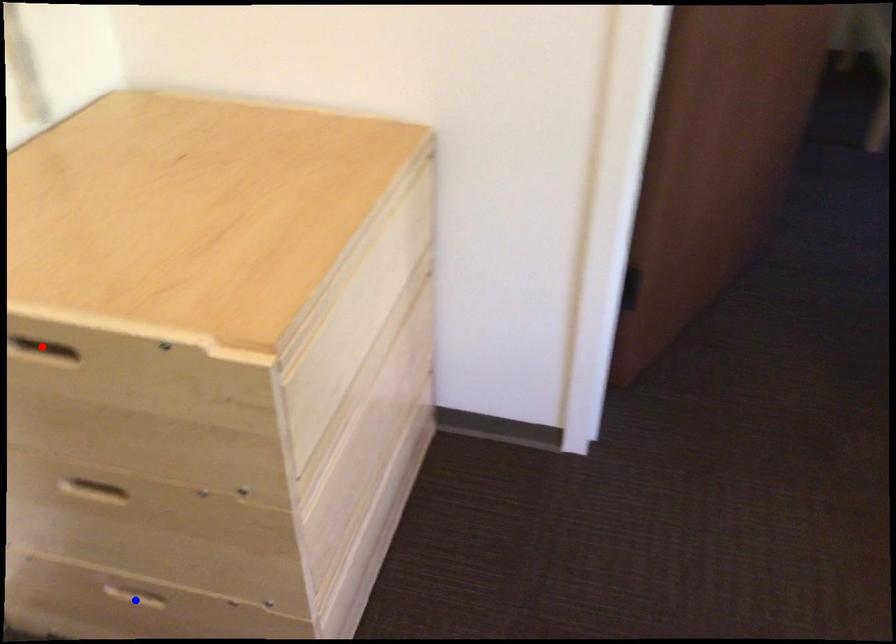
Question: Which of the two points in the image is closer to the camera?

Choices:
 (A) Blue point is closer.
 (B) Red point is closer.

Answer: (B)